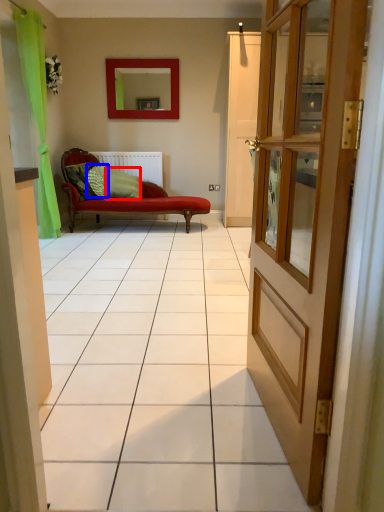
Question: Which of the following is the closest to the observer, pillow (highlighted by a red box) or pillow (highlighted by a blue box)?

Choices:
 (A) pillow
 (B) pillow

Answer: (B)